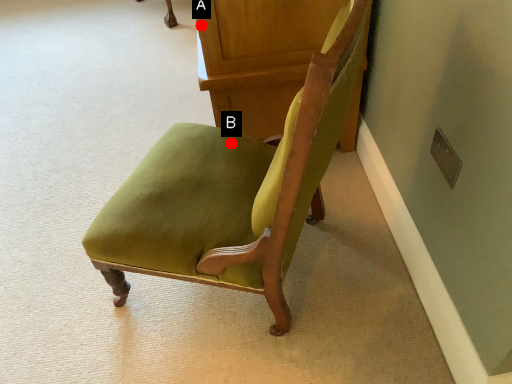
Question: Two points are circled on the image, labeled by A and B beside each circle. Which point is further to the camera?

Choices:
 (A) A is further
 (B) B is further

Answer: (A)